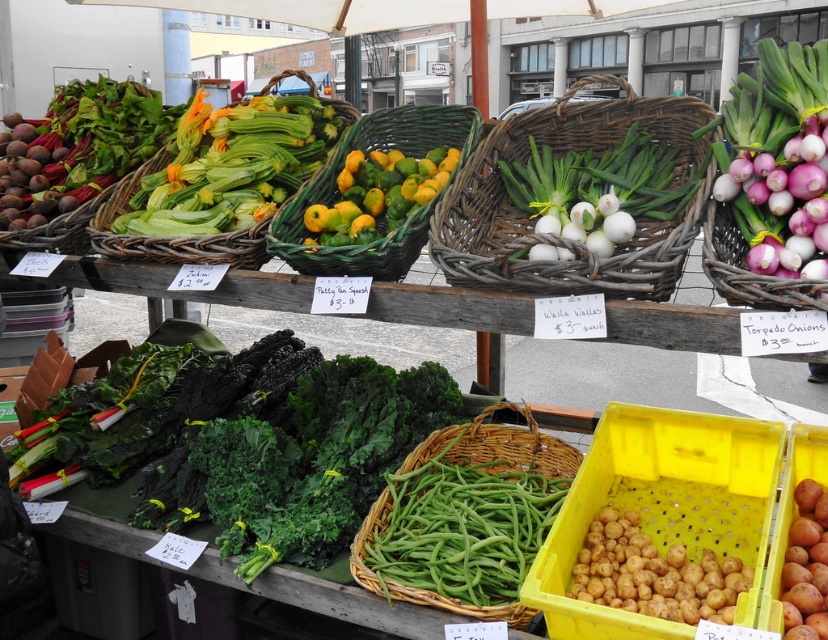
You are a customer at the market and want to buy both the bright green leafy vegetables at left and the yellow matte potatoes at lower right. The vendor has a rule that items with larger widths must be placed on the left side of the basket to keep them fresh. Based on their widths, where should you place each item in your basket?

The bright green leafy vegetables at left are wider than the yellow matte potatoes at lower right. According to the vendor rule, the wider item should be placed on the left side of the basket. Therefore, the bright green leafy vegetables at left should be placed on the left side, and the yellow matte potatoes at lower right should be placed on the right side.

You are a customer at the market and want to pick up both the bright green leafy vegetables at left and the yellow matte potatoes at lower right. Which item will you reach first if you approach the stall from the front?

You will reach the bright green leafy vegetables at left first because they are closer to you than the yellow matte potatoes at lower right, which are further away.